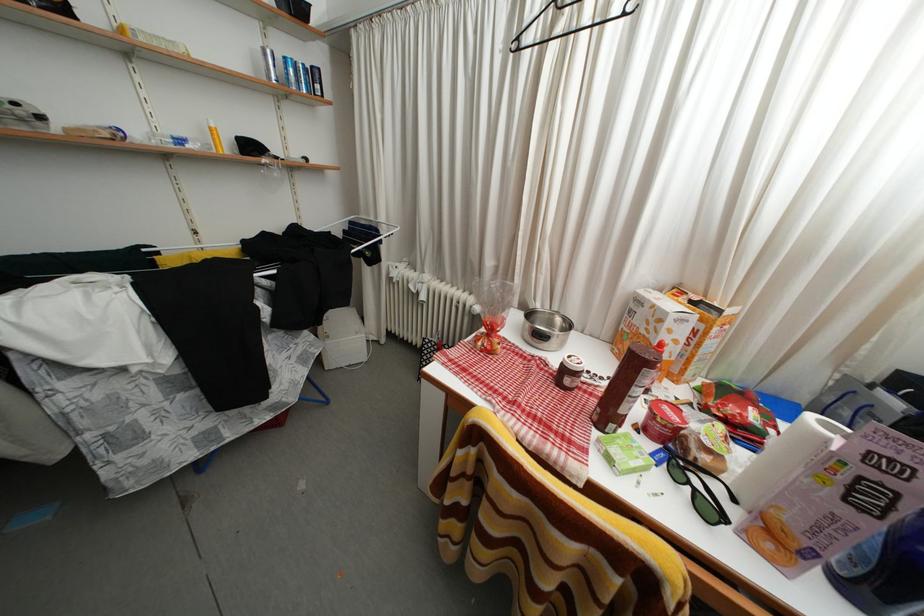
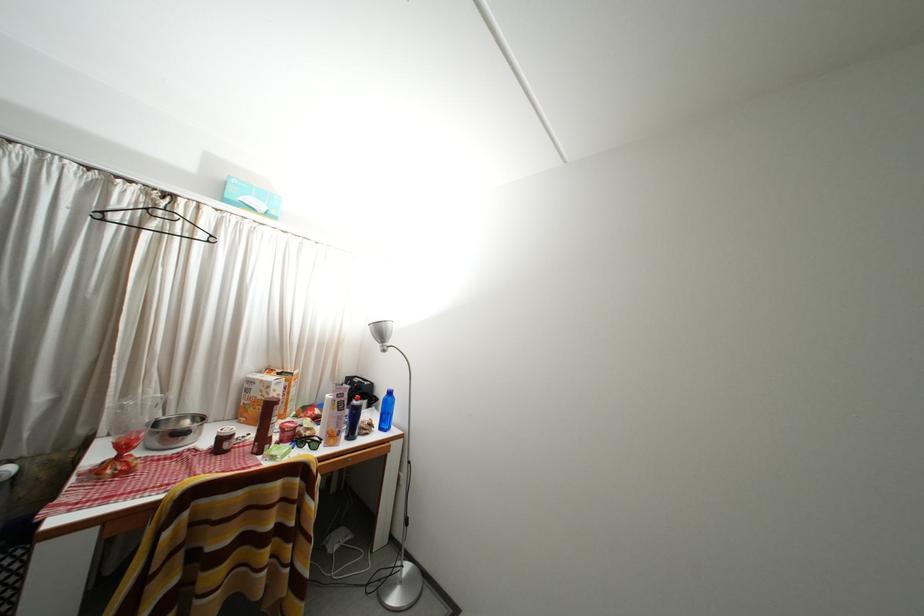
Find the pixel in the second image that matches point (711, 464) in the first image.

(315, 439)